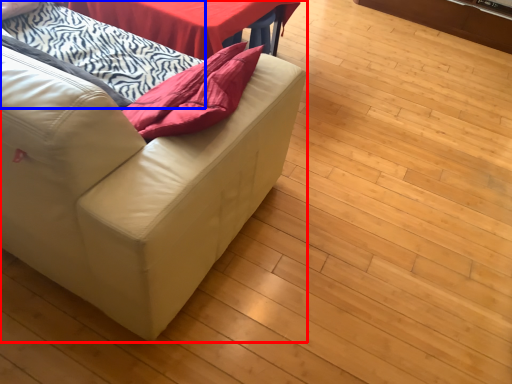
Question: Which object appears closest to the camera in this image, studio couch (highlighted by a red box) or blanket (highlighted by a blue box)?

Choices:
 (A) studio couch
 (B) blanket

Answer: (A)